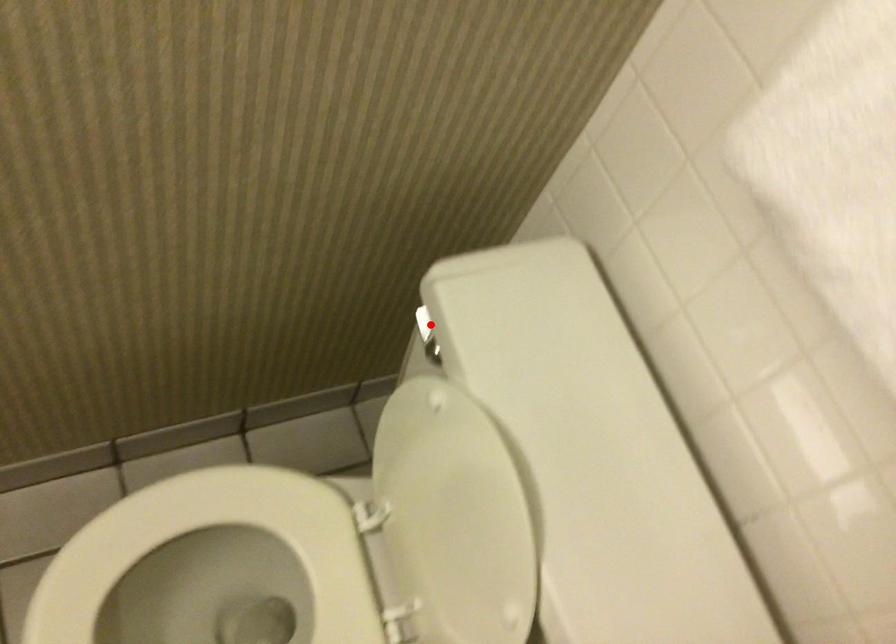
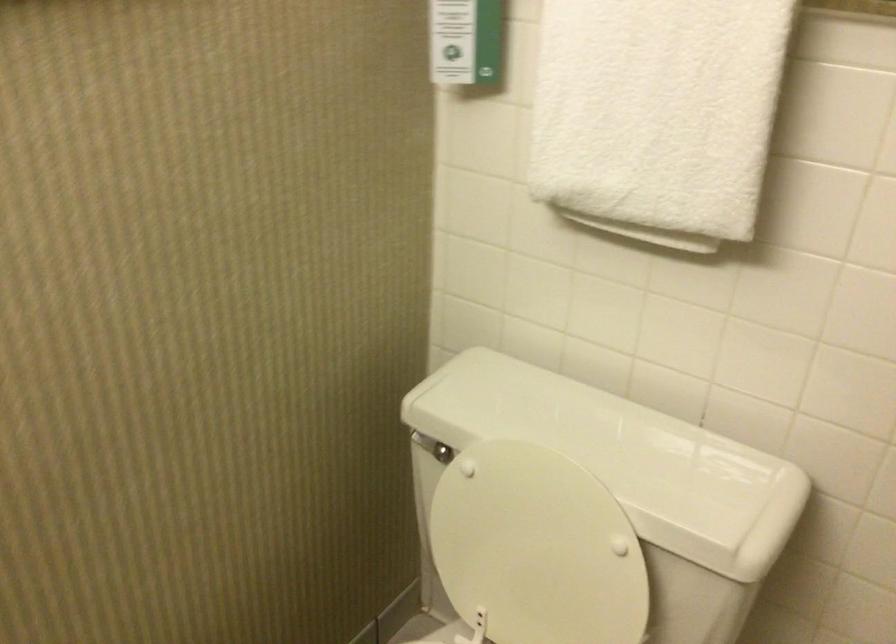
In the second image, find the point that corresponds to the highlighted location in the first image.

(425, 444)